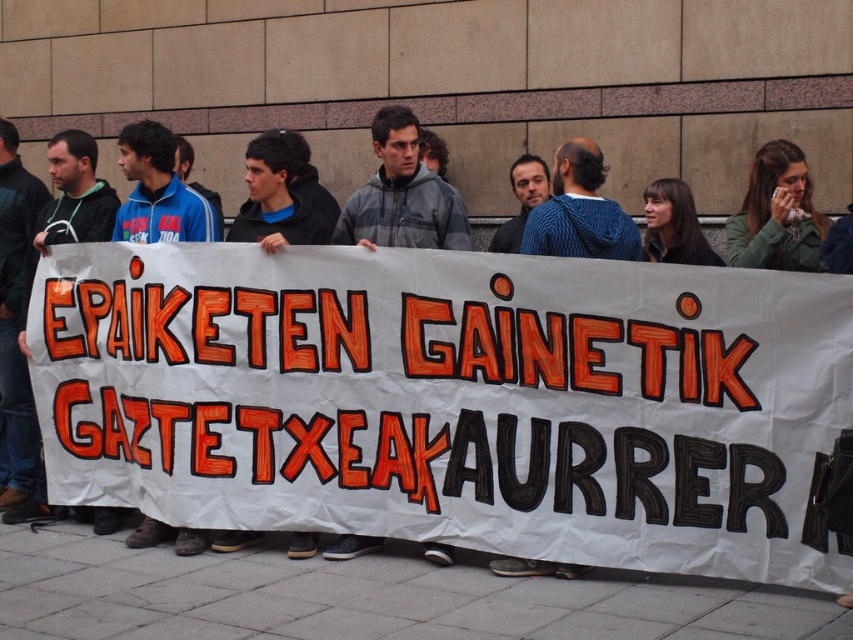
You are a photographer trying to capture a clear photo of the white paper banner at center and the green fabric scarf at upper right. The minimum distance your camera can focus clearly is 1.2 meters. Can you take a photo where both objects are in focus without moving your camera?

The white paper banner at center is only 1.14 meters away from the green fabric scarf at upper right, which is less than the camera minimum focusing distance of 1.2 meters. Therefore, you cannot take a photo where both objects are in focus without moving the camera.

You are organizing a protest and need to know which object is wider between the white paper banner at center and the green fabric scarf at upper right. Which one is wider?

The white paper banner at center is wider than the green fabric scarf at upper right according to the description.

You are a photographer trying to capture the banner and the scarf in a single shot. Given that the white paper banner at center is larger than the green fabric scarf at upper right, which object should you focus on first to ensure both are in frame?

The white paper banner at center is larger than the green fabric scarf at upper right, so you should focus on the white paper banner at center first to ensure it fits within the frame, then adjust to include the smaller green fabric scarf at upper right.